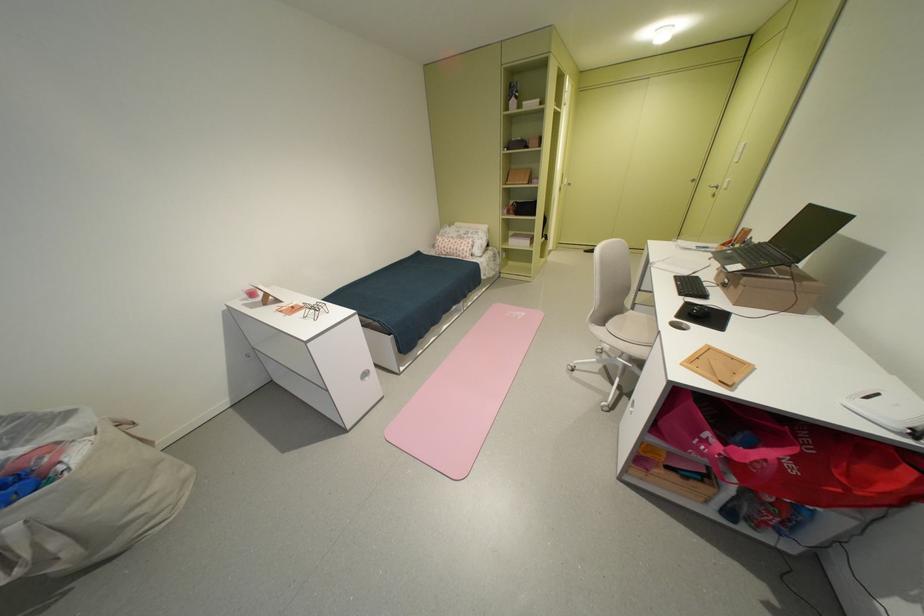
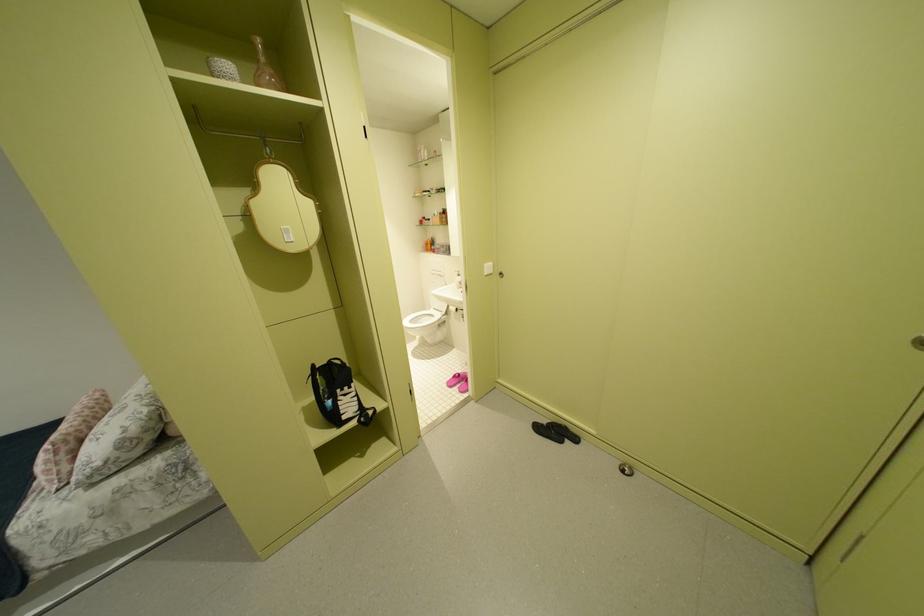
Which direction would the cameraman need to move to produce the second image?

The cameraman moved toward right, forward.